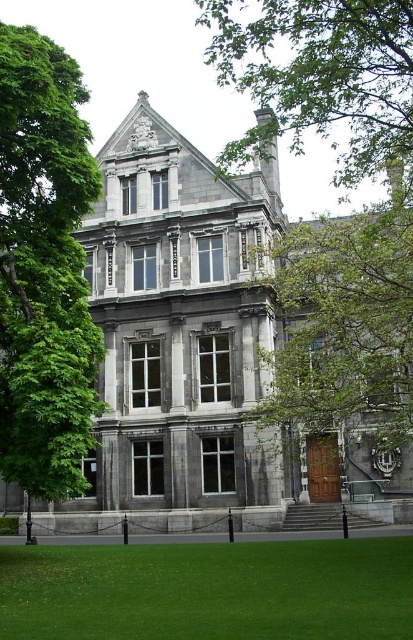
Question: Which of the following is the closest to the observer?

Choices:
 (A) green grass at lower center
 (B) green leafy tree at center

Answer: (A)

Question: Which of the following is the farthest from the observer?

Choices:
 (A) (329, 627)
 (B) (406, 182)
 (C) (52, 419)

Answer: (B)

Question: Can you confirm if green leafy tree at center is bigger than green leafy tree at upper center?

Choices:
 (A) no
 (B) yes

Answer: (B)

Question: Which point is closer to the camera?

Choices:
 (A) (52, 467)
 (B) (389, 545)

Answer: (A)

Question: Is green leafy tree at left behind green leafy tree at upper center?

Choices:
 (A) no
 (B) yes

Answer: (B)

Question: Can you confirm if green leafy tree at center is positioned above green leafy tree at left?

Choices:
 (A) no
 (B) yes

Answer: (B)